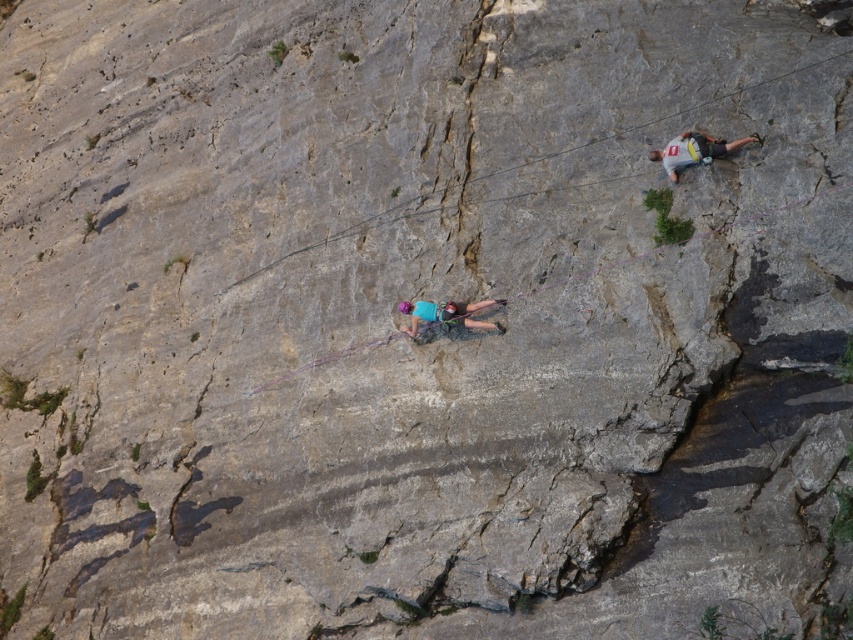
Who is positioned more to the right, matte purple helmet at center or gray fabric shirt at upper right?

gray fabric shirt at upper right is more to the right.

Does matte purple helmet at center appear over gray fabric shirt at upper right?

No.

Locate an element on the screen. The height and width of the screenshot is (640, 853). matte purple helmet at center is located at coordinates (445, 320).